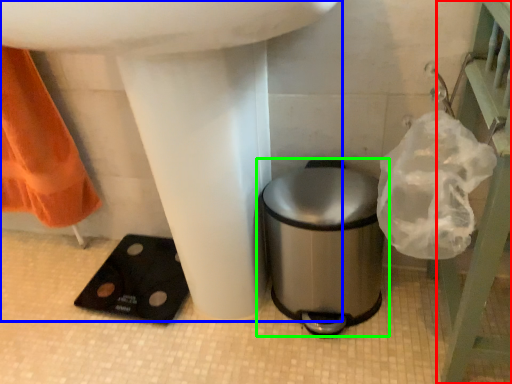
Question: Estimate the real-world distances between objects in this image. Which object is farther from balustrade (highlighted by a red box), sink (highlighted by a blue box) or waste container (highlighted by a green box)?

Choices:
 (A) sink
 (B) waste container

Answer: (A)